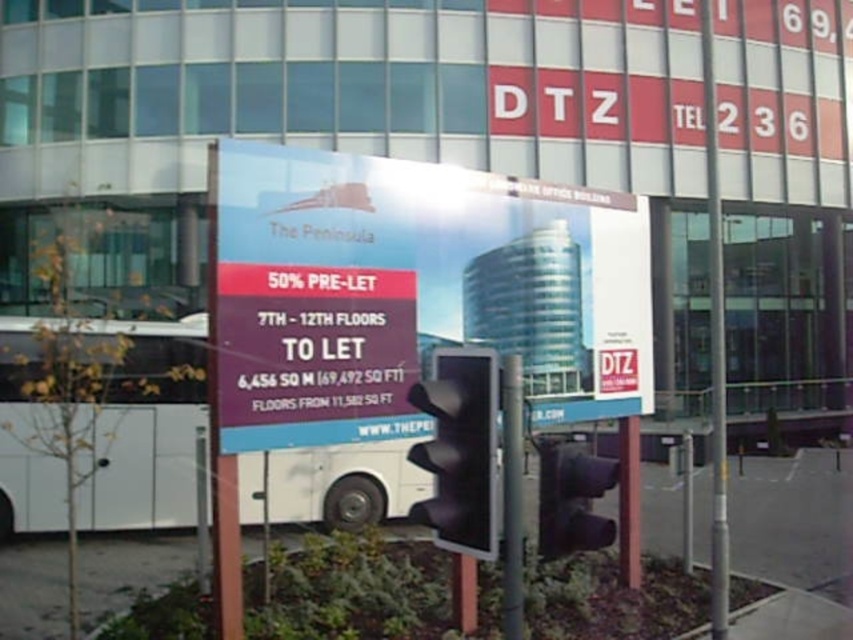
You are a pedestrian standing in front of the large advertisement sign in the urban scene. You notice two traffic lights labeled as black matte traffic light at center and matte black traffic light at center. Which one is smaller in size?

The black matte traffic light at center is smaller in size compared to the matte black traffic light at center.

You are a city planner reviewing the urban scene. The white glossy billboard at center and the silver metallic pole at center are both in the foreground. Which object takes up more space in the image?

The silver metallic pole at center takes up more space in the image because the white glossy billboard at center occupies less space than the silver metallic pole at center.